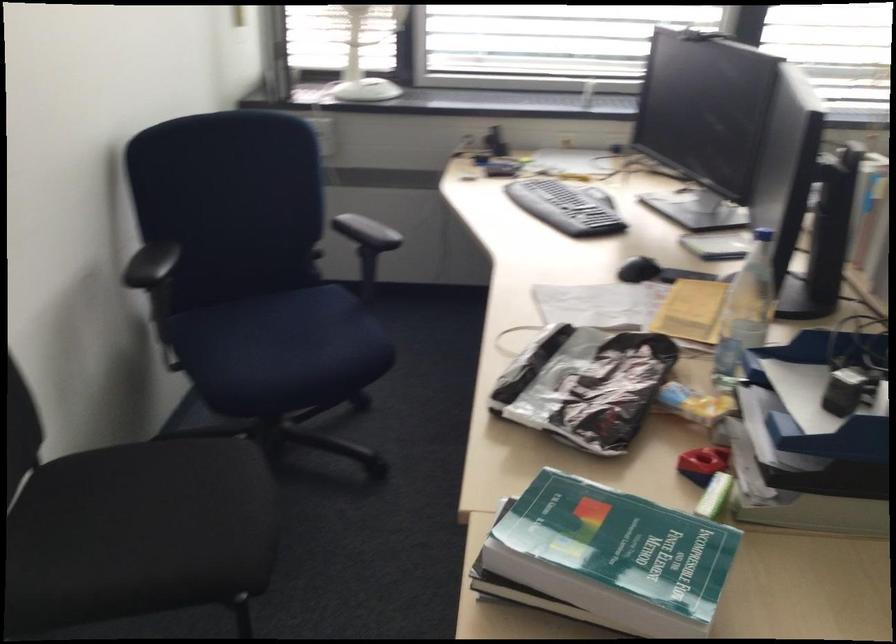
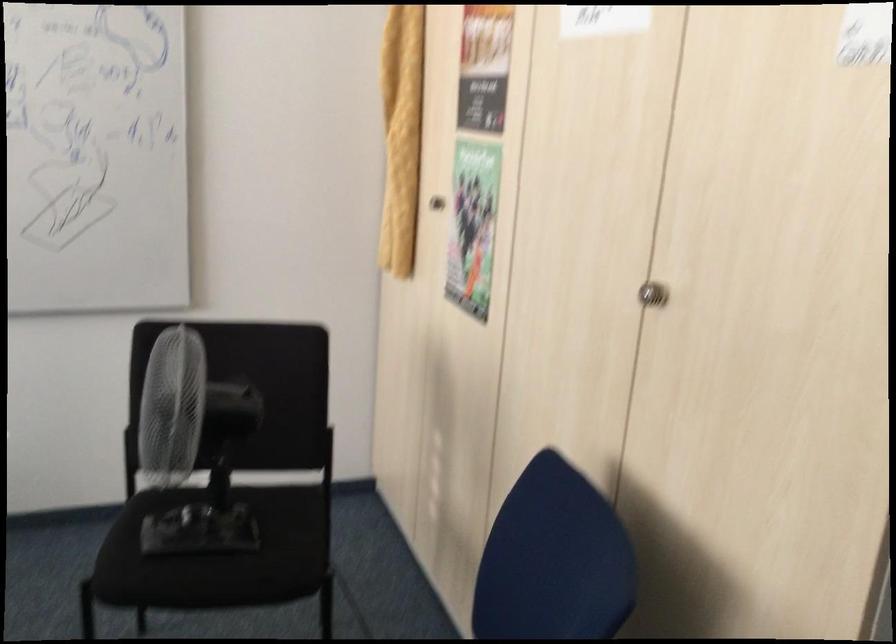
The images are taken continuously from a first-person perspective. In which direction is your viewpoint rotating?

The camera rotated toward right-down.